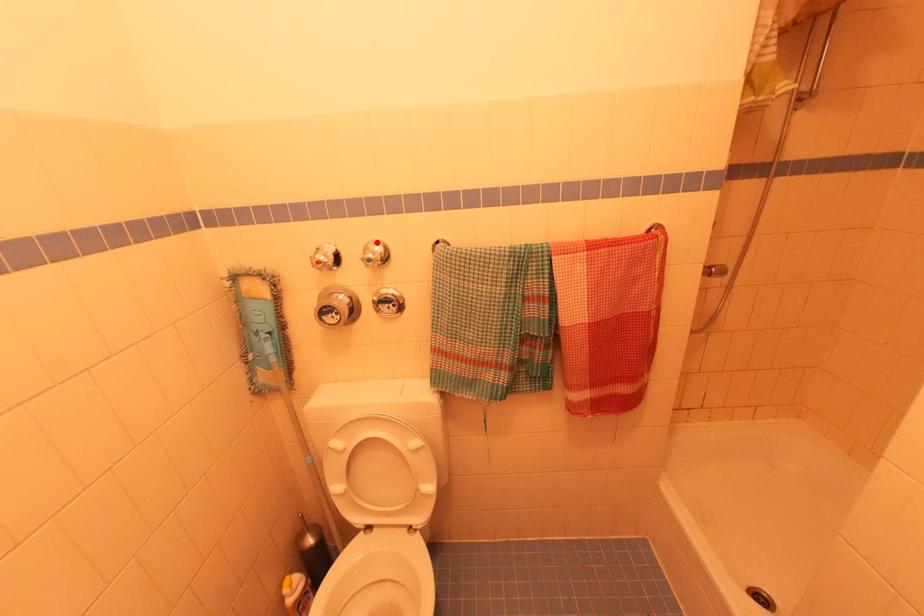
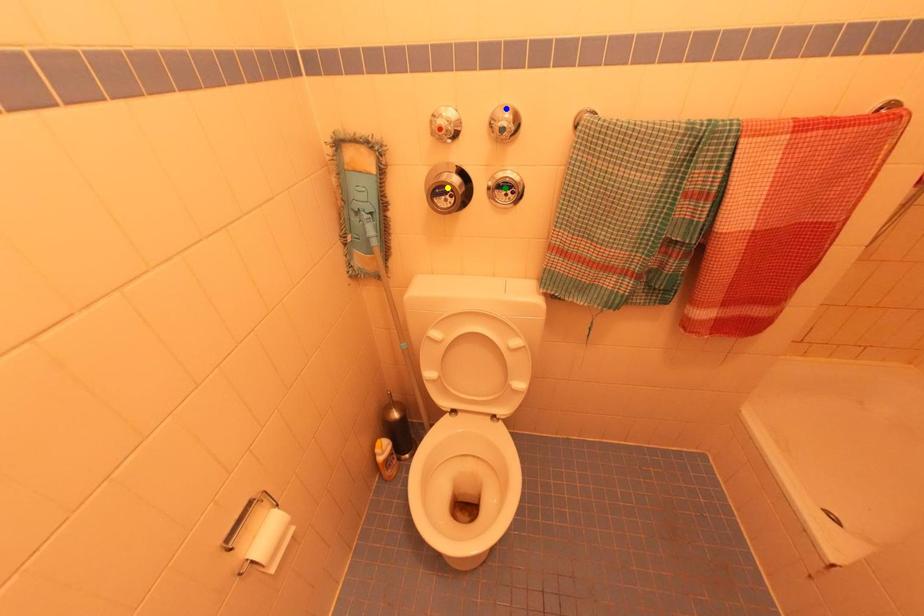
Question: I am providing you with two images of the same scene from different viewpoints. A red point is marked on the first image. You are given multiple points on the second image. Can you choose the point in image 2 that corresponds to the point in image 1?

Choices:
 (A) green point
 (B) yellow point
 (C) blue point

Answer: (C)